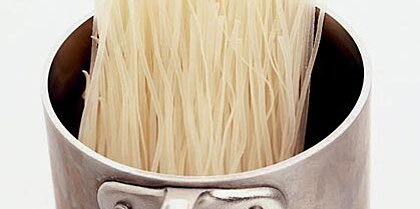
This screenshot has width=420, height=209. I want to click on grey pot, so click(294, 180).